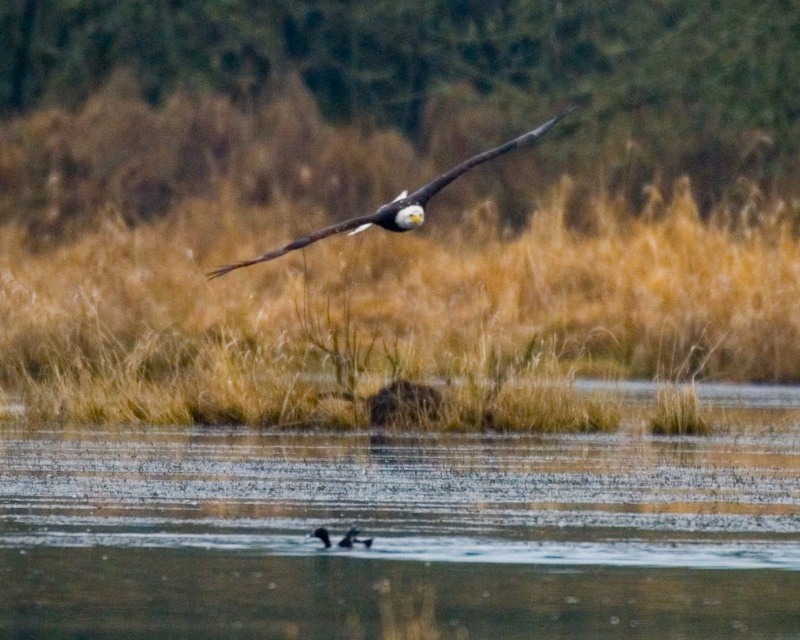
You are a photographer trying to capture the reflection of the bald eagle in the water. According to the coordinates provided, where should you aim your camera to ensure the reflection is visible in the clear water at center?

You should aim your camera at the coordinates point (397, 534) where the clear water at center is located to capture the reflection of the bald eagle.